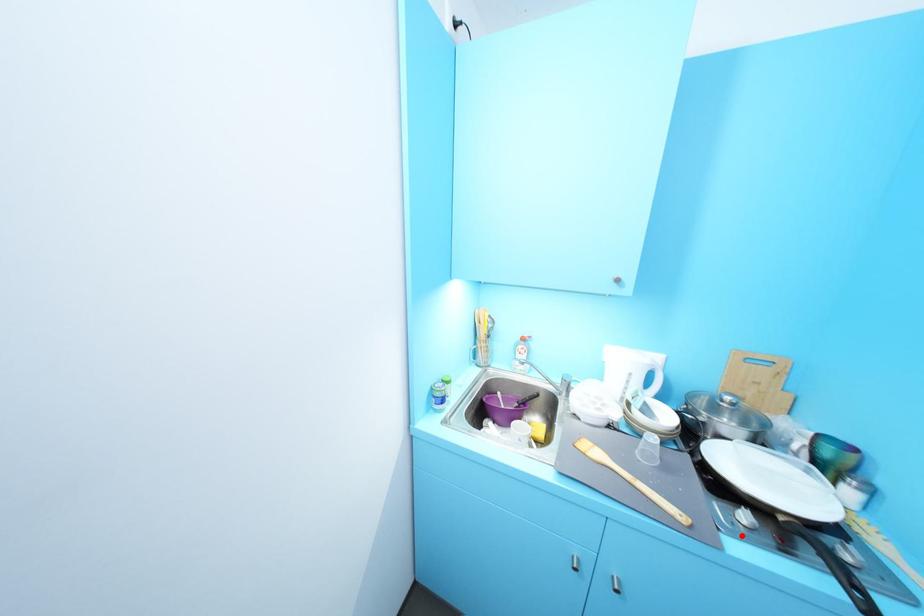
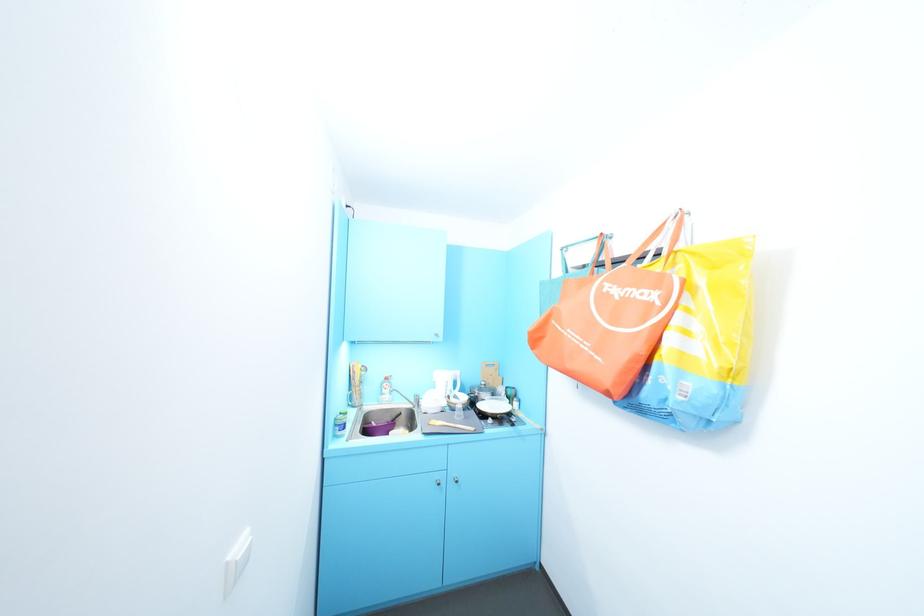
Question: I am providing you with two images of the same scene from different viewpoints. A red point is marked on the first image. At the location where the point appears in image 1, is it still visible in image 2?

Choices:
 (A) Yes
 (B) No

Answer: (A)